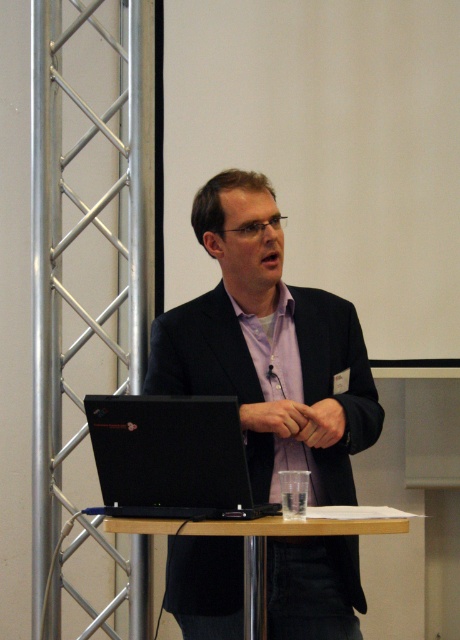
Measure the distance between matte black suit at center and camera.

The distance of matte black suit at center from camera is 7.10 feet.

Looking at this image, between matte black suit at center and black matte laptop at center, which one appears on the left side from the viewer's perspective?

Positioned to the left is black matte laptop at center.

What do you see at coordinates (269, 348) in the screenshot? I see `matte black suit at center` at bounding box center [269, 348].

The image size is (460, 640). I want to click on matte black suit at center, so click(269, 348).

Does matte black suit at center have a larger size compared to purple cotton dress shirt at center?

Yes.

Does matte black suit at center appear on the right side of purple cotton dress shirt at center?

No, matte black suit at center is not to the right of purple cotton dress shirt at center.

Is point (213, 305) positioned behind point (288, 440)?

Yes, point (213, 305) is behind point (288, 440).

Where is `matte black suit at center`? The image size is (460, 640). matte black suit at center is located at coordinates (269, 348).

Can you confirm if matte black suit at center is shorter than wooden table at center?

No, matte black suit at center is not shorter than wooden table at center.

Is point (201, 608) farther from camera compared to point (316, 518)?

Yes, it is behind point (316, 518).

Where is `matte black suit at center`? Image resolution: width=460 pixels, height=640 pixels. matte black suit at center is located at coordinates (269, 348).